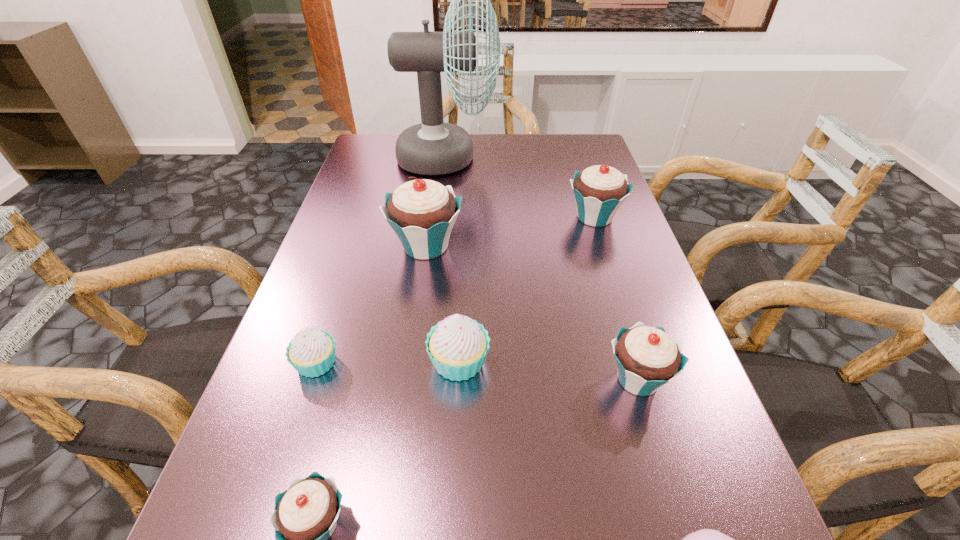
The height and width of the screenshot is (540, 960). Identify the location of free space at the right edge of the desktop. (666, 395).

Locate an element on the screen. vacant space at the far left corner is located at coordinates pyautogui.click(x=385, y=148).

Identify the location of free space at the far right corner of the desktop. (586, 159).

Where is `vacant space that is in between the third smallest teal cupcake and the second tallest object`? This screenshot has width=960, height=540. vacant space that is in between the third smallest teal cupcake and the second tallest object is located at coordinates (510, 232).

I want to click on vacant area that lies between the second smallest teal cupcake and the fan, so click(x=542, y=269).

I want to click on empty space between the left white cupcake and the bigger white cupcake, so click(388, 362).

Image resolution: width=960 pixels, height=540 pixels. Identify the location of free spot between the second biggest teal cupcake and the third biggest teal cupcake. (616, 298).

Locate an element on the screen. This screenshot has width=960, height=540. free point between the bigger white cupcake and the sixth shortest object is located at coordinates (527, 289).

In order to click on object that is the closest to the third farthest teal cupcake in this screenshot , I will do `click(706, 539)`.

Where is `object identified as the sixth closest to the bigger white cupcake`? The height and width of the screenshot is (540, 960). object identified as the sixth closest to the bigger white cupcake is located at coordinates (599, 191).